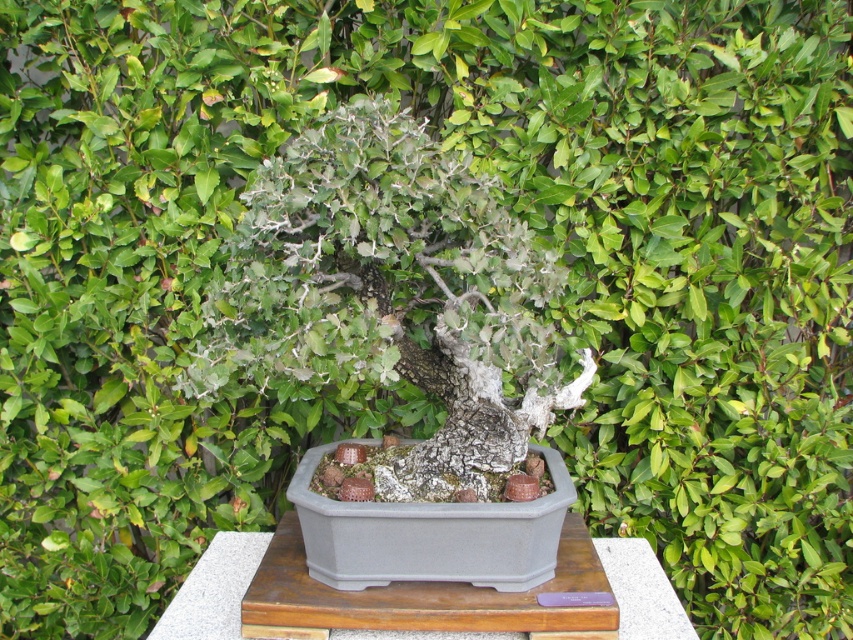
Question: Does gray bark bonsai at center appear on the left side of gray wood table at center?

Choices:
 (A) yes
 (B) no

Answer: (A)

Question: Which of the following is the closest to the observer?

Choices:
 (A) gray wood table at center
 (B) gray bark bonsai at center

Answer: (B)

Question: Can you confirm if gray bark bonsai at center is thinner than gray wood table at center?

Choices:
 (A) no
 (B) yes

Answer: (B)

Question: Which of the following is the closest to the observer?

Choices:
 (A) gray bark bonsai at center
 (B) gray wood table at center

Answer: (A)

Question: Is gray bark bonsai at center smaller than gray wood table at center?

Choices:
 (A) no
 (B) yes

Answer: (A)